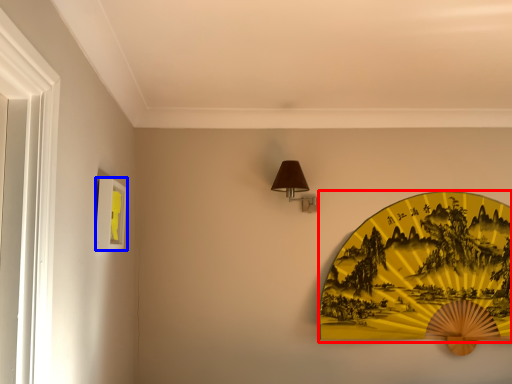
Question: Which object appears closest to the camera in this image, design (highlighted by a red box) or picture frame (highlighted by a blue box)?

Choices:
 (A) design
 (B) picture frame

Answer: (B)